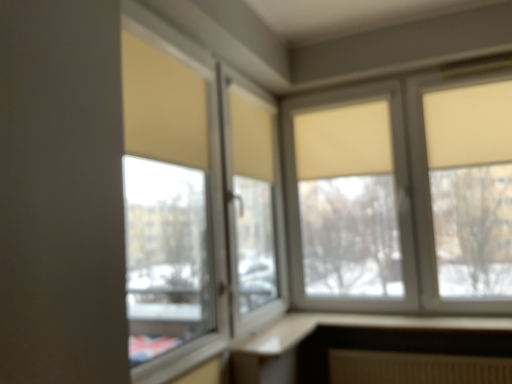
This screenshot has height=384, width=512. What are the coordinates of `free space above beige fabric curtain at center (from a real-world perspective)` in the screenshot? It's located at (347, 97).